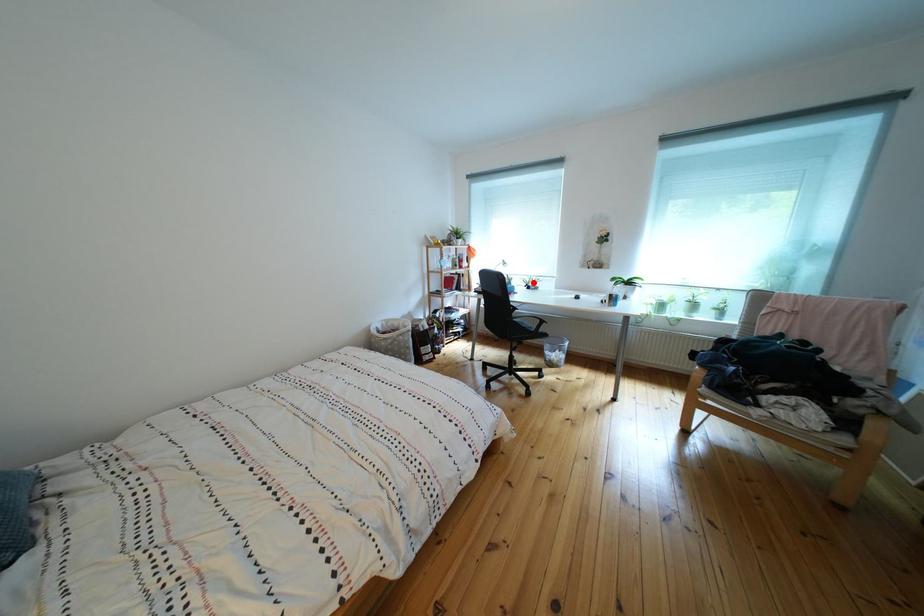
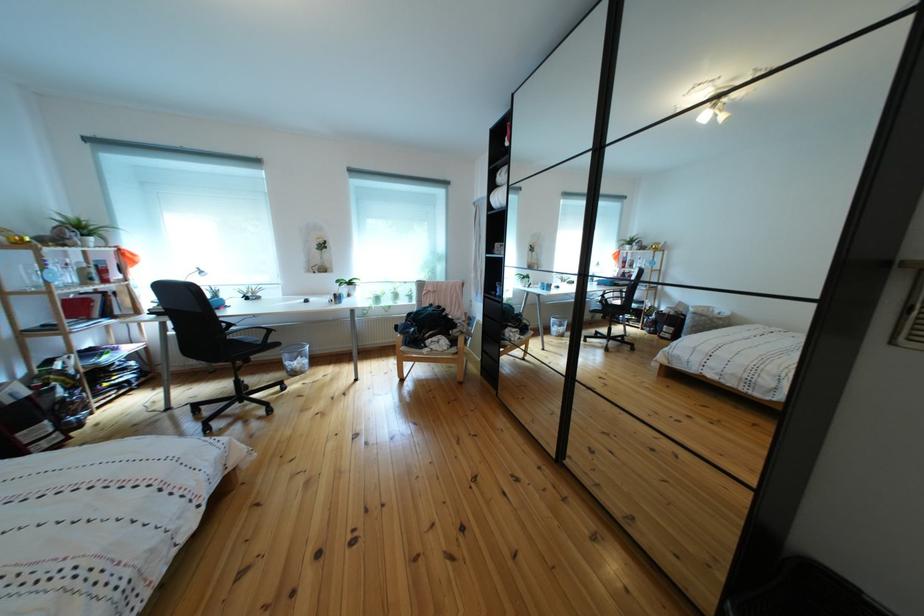
Question: I am providing you with two images of the same scene from different viewpoints. A red point is marked on the first image. Can you still see the location of the red point in image 2?

Choices:
 (A) Yes
 (B) No

Answer: (A)